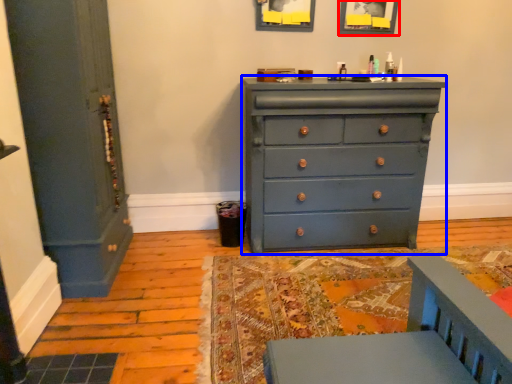
Question: Which object is further to the camera taking this photo, picture frame (highlighted by a red box) or chest of drawers (highlighted by a blue box)?

Choices:
 (A) picture frame
 (B) chest of drawers

Answer: (A)